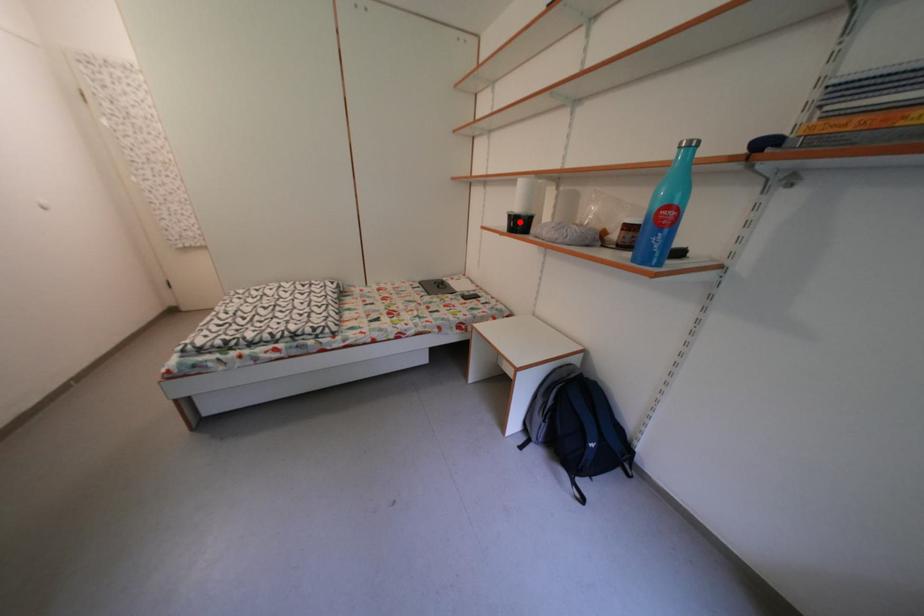
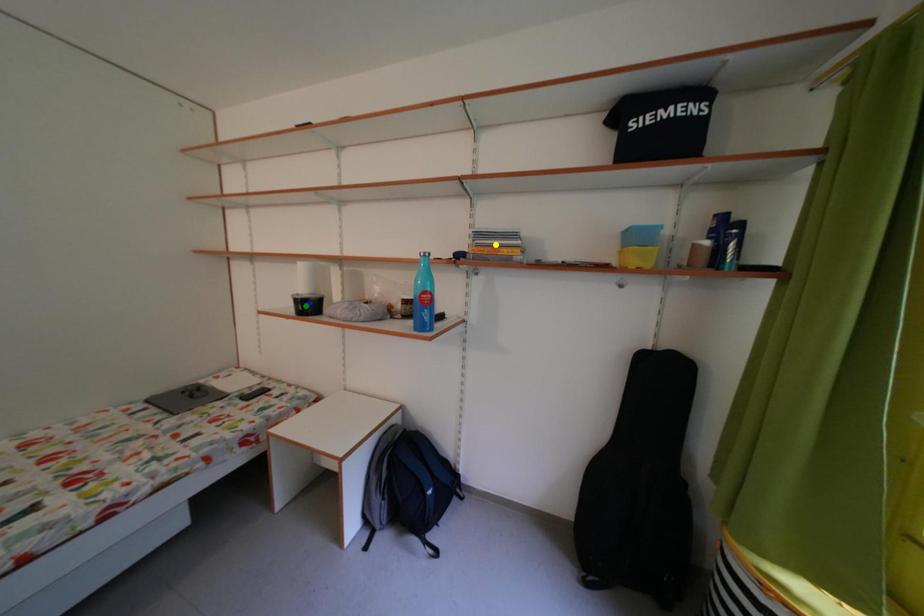
Question: I am providing you with two images of the same scene from different viewpoints. A red point is marked on the first image. You are given multiple points on the second image. Which mark in image 2 goes with the point in image 1?

Choices:
 (A) blue point
 (B) yellow point
 (C) green point

Answer: (C)